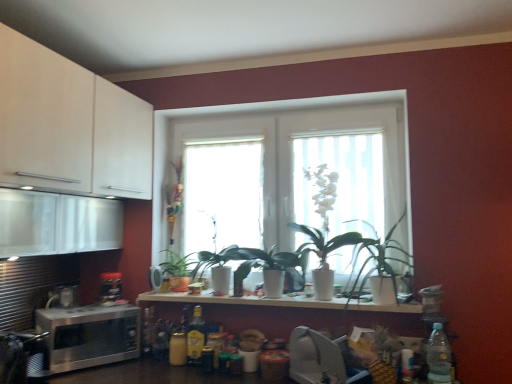
Question: Does point (92, 304) appear closer or farther from the camera than point (167, 258)?

Choices:
 (A) closer
 (B) farther

Answer: (A)

Question: Relative to green matte plant at center, marked as the second houseplant in a front-to-back arrangement, is satin silver microwave at lower left in front or behind?

Choices:
 (A) front
 (B) behind

Answer: (A)

Question: Which of these objects is positioned farthest from the white glossy windows at center?

Choices:
 (A) satin silver microwave at left, the 2th appliance positioned from the left
 (B) translucent glass bottle at center, acting as the 3th bottle starting from the right
 (C) clear plastic bottle at lower right, which appears as the 1th bottle when viewed from the right
 (D) metallic silver toaster at lower center, the third appliance in the left-to-right sequence
 (E) satin silver microwave at lower left, the third appliance when ordered from right to left

Answer: (E)

Question: Which of these objects is positioned closest to the green matte plant at center, marked as the second houseplant in a front-to-back arrangement?

Choices:
 (A) white matte countertop at center
 (B) translucent glass window at center
 (C) green matte plant at center, which is the second houseplant in back-to-front order
 (D) white glossy pot at center, which ranks as the first plant in left-to-right order
 (E) satin silver microwave at left, the 2th appliance positioned from the left

Answer: (E)